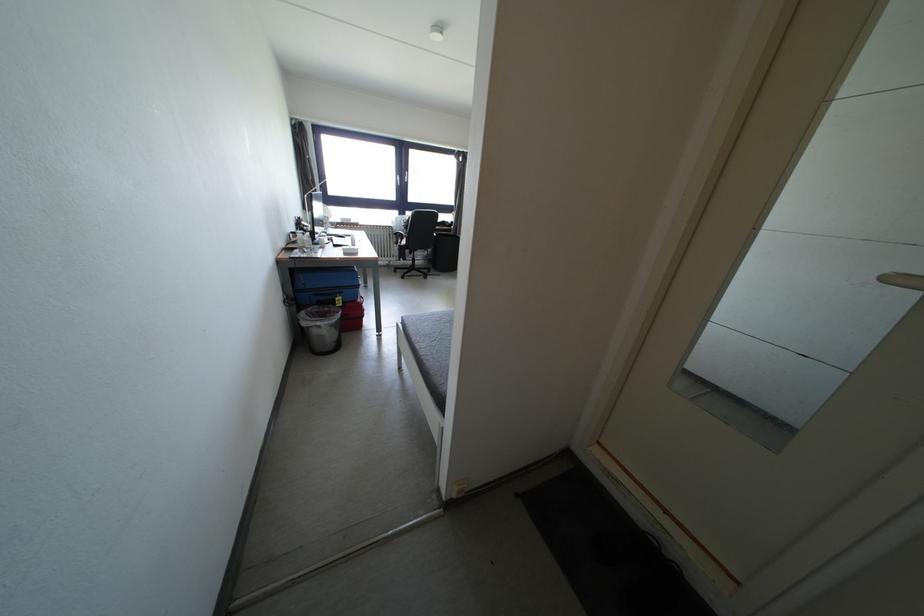
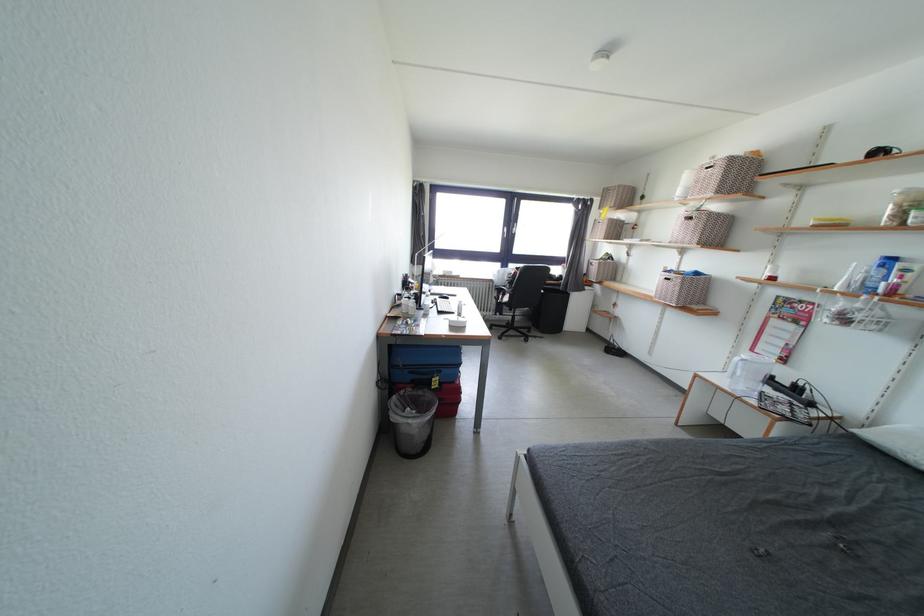
Locate, in the second image, the point that corresponds to the point at 344,302 in the first image.

(440, 384)